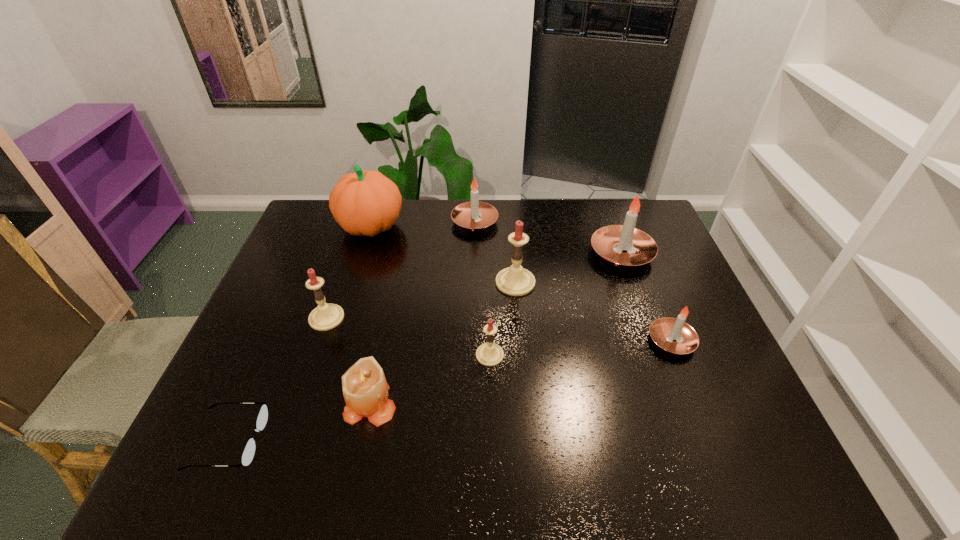
Locate an element on the screen. This screenshot has width=960, height=540. the shortest object is located at coordinates (248, 453).

Locate an element on the screen. The image size is (960, 540). black spectacles is located at coordinates point(248,453).

The height and width of the screenshot is (540, 960). What are the coordinates of `free spot located 0.170m on the right of the pumpkin` in the screenshot? It's located at (453, 226).

This screenshot has width=960, height=540. What are the coordinates of `vacant space located on the back of the biggest white candle` in the screenshot? It's located at (603, 201).

This screenshot has height=540, width=960. I want to click on vacant position located 0.400m on the front of the farthest red candle, so click(x=527, y=422).

Locate an element on the screen. free point located on the left of the leftmost white candle is located at coordinates (342, 222).

Locate an element on the screen. This screenshot has width=960, height=540. free location located 0.160m on the front of the second farthest red candle is located at coordinates (305, 381).

Identify the location of vacant space located 0.210m on the back of the nearest white candle. click(x=644, y=272).

At what (x,y) coordinates should I click in order to perform the action: click on free space located on the front of the nearest red candle. Please return your answer as a coordinate pair (x, y). The width and height of the screenshot is (960, 540). Looking at the image, I should click on point(492,426).

Identify the location of free region located 0.330m on the back of the sixth candle from right to left. (394, 287).